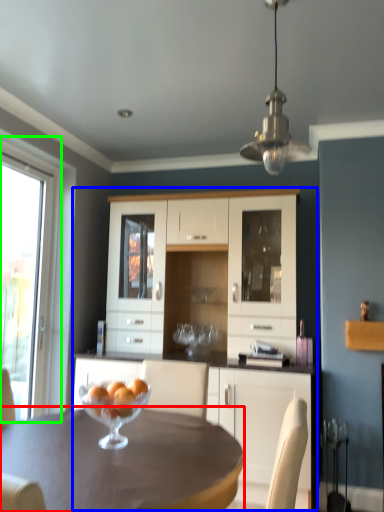
Question: Based on their relative distances, which object is nearer to desk (highlighted by a red box)? Choose from cupboard (highlighted by a blue box) and window (highlighted by a green box).

Choices:
 (A) cupboard
 (B) window

Answer: (A)